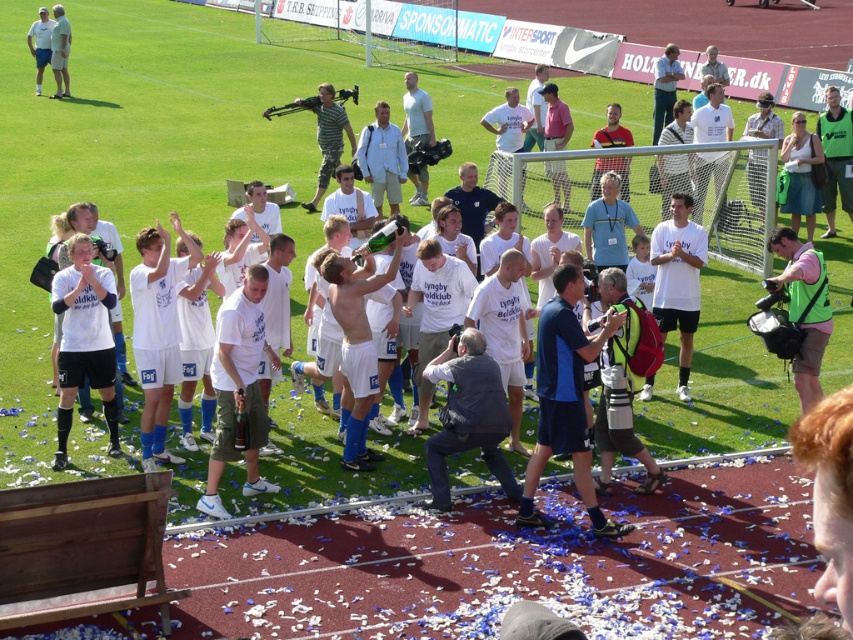
Is blue fabric jacket at center wider than matte white jersey at left?

Correct, the width of blue fabric jacket at center exceeds that of matte white jersey at left.

Measure the distance between point (x=556, y=376) and camera.

Point (x=556, y=376) and camera are 10.41 meters apart from each other.

The height and width of the screenshot is (640, 853). Identify the location of blue fabric jacket at center. (566, 397).

Does white matte shirt at center have a greater width compared to green fabric vest at lower right?

Yes.

Can you confirm if white matte shirt at center is shorter than green fabric vest at lower right?

Incorrect, white matte shirt at center's height does not fall short of green fabric vest at lower right's.

Who is more forward, (675, 294) or (781, 253)?

Point (781, 253)

What are the coordinates of `white matte shirt at center` in the screenshot? It's located at click(x=677, y=280).

Is the position of light blue shirt at upper left more distant than that of white t-shirt at center?

Yes, light blue shirt at upper left is further from the viewer.

Can you confirm if light blue shirt at upper left is positioned to the left of white t-shirt at center?

No, light blue shirt at upper left is not to the left of white t-shirt at center.

What do you see at coordinates (61, 51) in the screenshot?
I see `light blue shirt at upper left` at bounding box center [61, 51].

You are a GUI agent. You are given a task and a screenshot of the screen. Output one action in this format:
    pyautogui.click(x=<x>, y=<y>)
    Task: Click on the light blue shirt at upper left
    The image size is (853, 640).
    Given the screenshot: What is the action you would take?
    pyautogui.click(x=61, y=51)